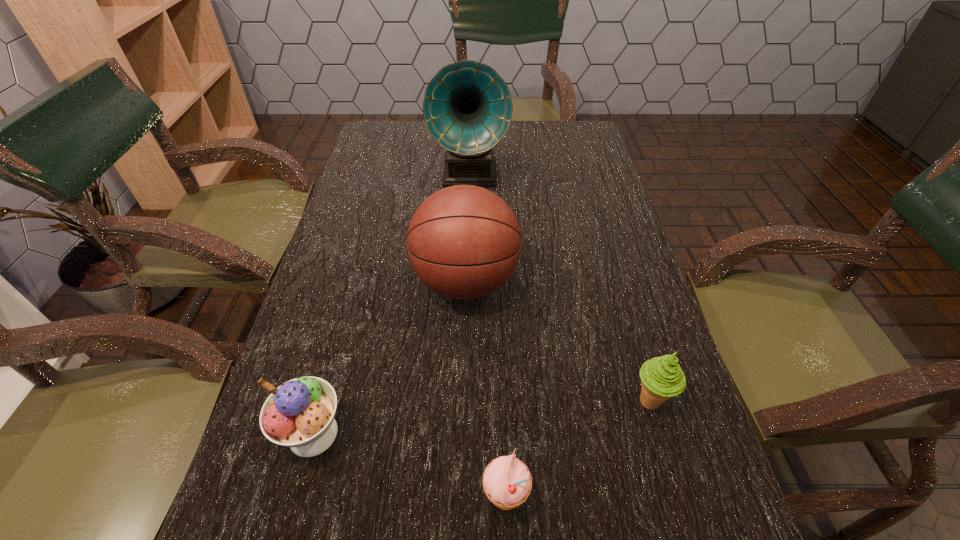
Identify which object is the third closest to the second tallest object. Please provide its 2D coordinates. Your answer should be formatted as a tuple, i.e. [(x, y)], where the tuple contains the x and y coordinates of a point satisfying the conditions above.

[(661, 377)]

Where is `the closest icecream to the leftmost icecream`? the closest icecream to the leftmost icecream is located at coordinates (507, 482).

Locate which icecream ranks second in proximity to the leftmost icecream. Please provide its 2D coordinates. Your answer should be formatted as a tuple, i.e. [(x, y)], where the tuple contains the x and y coordinates of a point satisfying the conditions above.

[(661, 377)]

This screenshot has height=540, width=960. In order to click on free space that satisfies the following two spatial constraints: 1. from the horn of the rightmost icecream; 2. on the right side of the farthest object in this screenshot , I will do `click(464, 402)`.